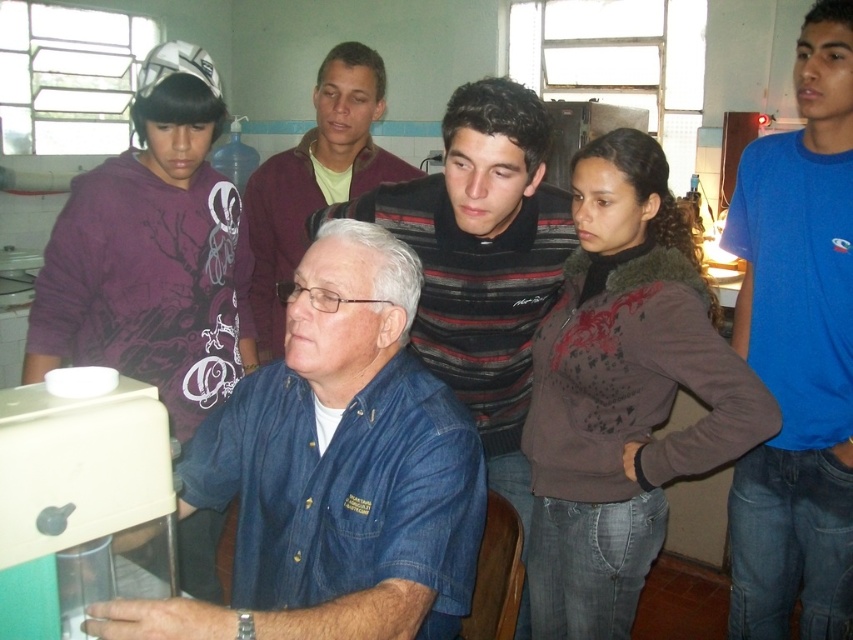
Who is positioned more to the right, brown fuzzy jacket at center or matte black shirt at center?

brown fuzzy jacket at center is more to the right.

Between point (653, 172) and point (291, 188), which one is positioned in front?

Point (653, 172) is in front.

The height and width of the screenshot is (640, 853). I want to click on brown fuzzy jacket at center, so click(x=624, y=394).

Does brown fuzzy jacket at center appear on the right side of blue cotton t-shirt at upper right?

In fact, brown fuzzy jacket at center is to the left of blue cotton t-shirt at upper right.

Which of these two, brown fuzzy jacket at center or blue cotton t-shirt at upper right, stands taller?

blue cotton t-shirt at upper right

I want to click on brown fuzzy jacket at center, so click(x=624, y=394).

Can you confirm if brown fuzzy jacket at center is positioned above purple hoodie at left?

No, brown fuzzy jacket at center is not above purple hoodie at left.

Does point (601, 577) lie behind point (219, 392)?

No, it is not.

The width and height of the screenshot is (853, 640). Describe the element at coordinates (624, 394) in the screenshot. I see `brown fuzzy jacket at center` at that location.

Where is `brown fuzzy jacket at center`? This screenshot has height=640, width=853. brown fuzzy jacket at center is located at coordinates (624, 394).